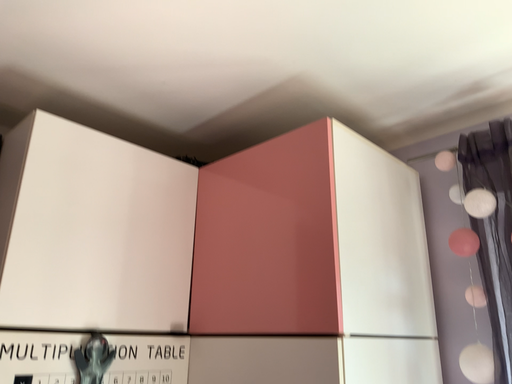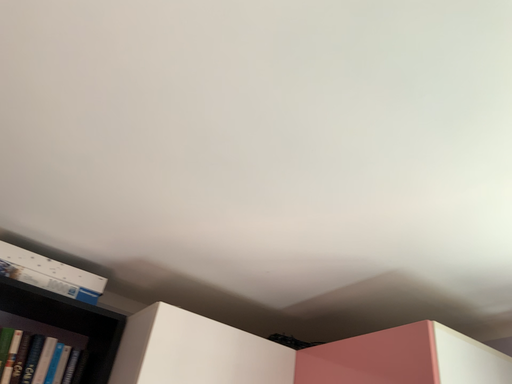
Question: How did the camera likely rotate when shooting the video?

Choices:
 (A) rotated downward
 (B) rotated upward

Answer: (B)